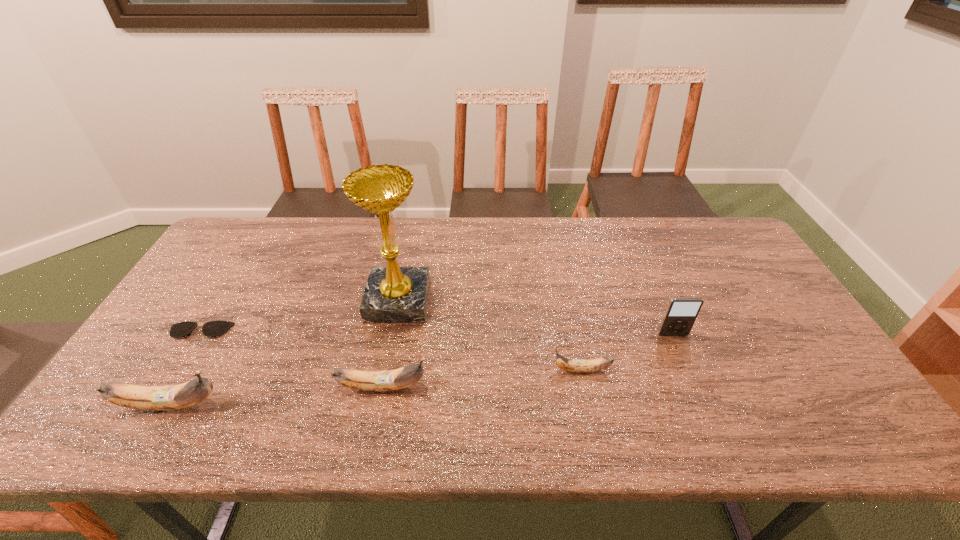
Identify which object is located as the nearest to the iPod. Please provide its 2D coordinates. Your answer should be formatted as a tuple, i.e. [(x, y)], where the tuple contains the x and y coordinates of a point satisfying the conditions above.

[(571, 365)]

Identify which banana is located as the second nearest to the award. Please provide its 2D coordinates. Your answer should be formatted as a tuple, i.e. [(x, y)], where the tuple contains the x and y coordinates of a point satisfying the conditions above.

[(168, 397)]

Point out which banana is positioned as the nearest to the spectacles. Please provide its 2D coordinates. Your answer should be formatted as a tuple, i.e. [(x, y)], where the tuple contains the x and y coordinates of a point satisfying the conditions above.

[(168, 397)]

At what (x,y) coordinates should I click in order to perform the action: click on vacant region that satisfies the following two spatial constraints: 1. on the front-facing side of the rightmost object; 2. on the peel of the second shortest object. Please return your answer as a coordinate pair (x, y). Looking at the image, I should click on (687, 370).